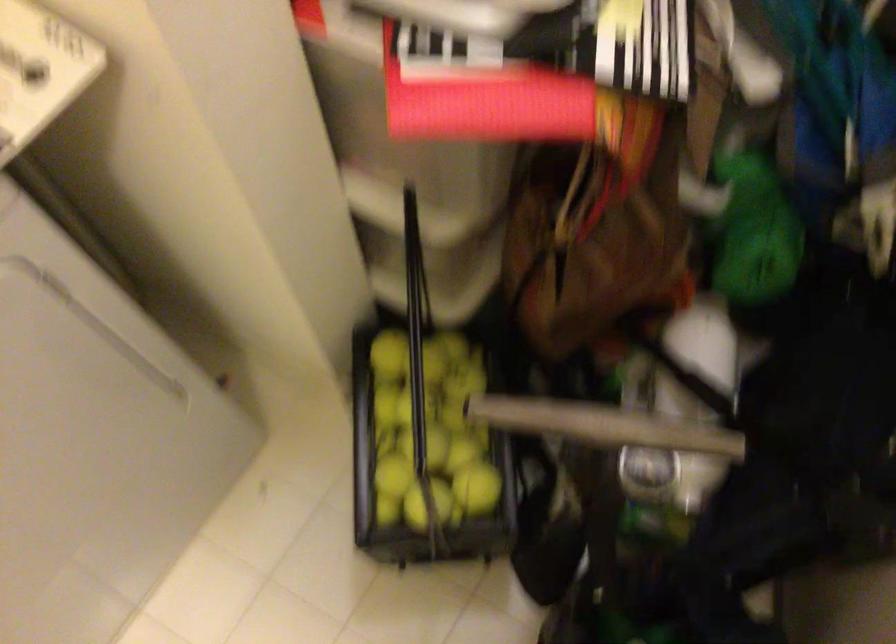
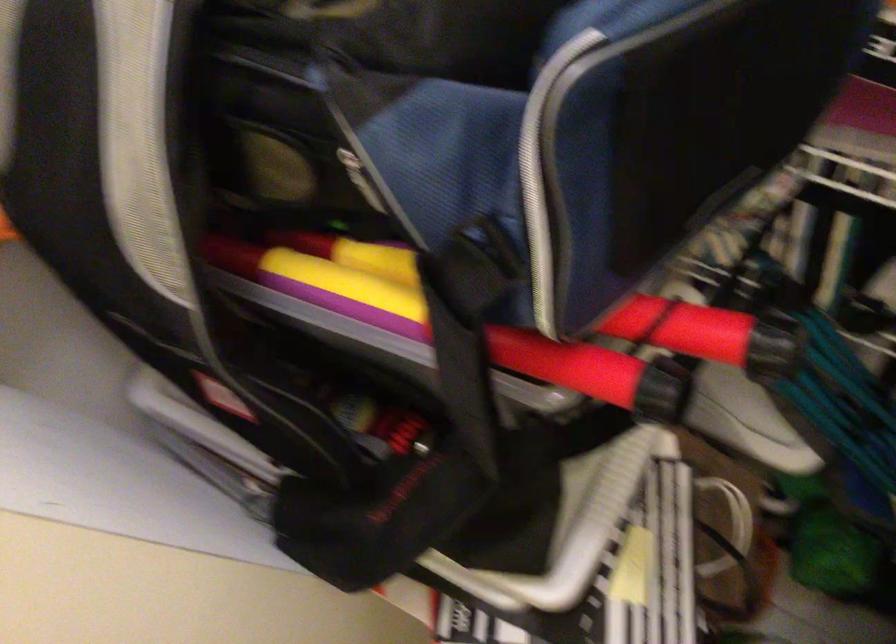
Question: Based on the continuous images, in which direction is the camera rotating? Reply with the corresponding letter.

Choices:
 (A) Left
 (B) Right
 (C) Up
 (D) Down

Answer: (A)